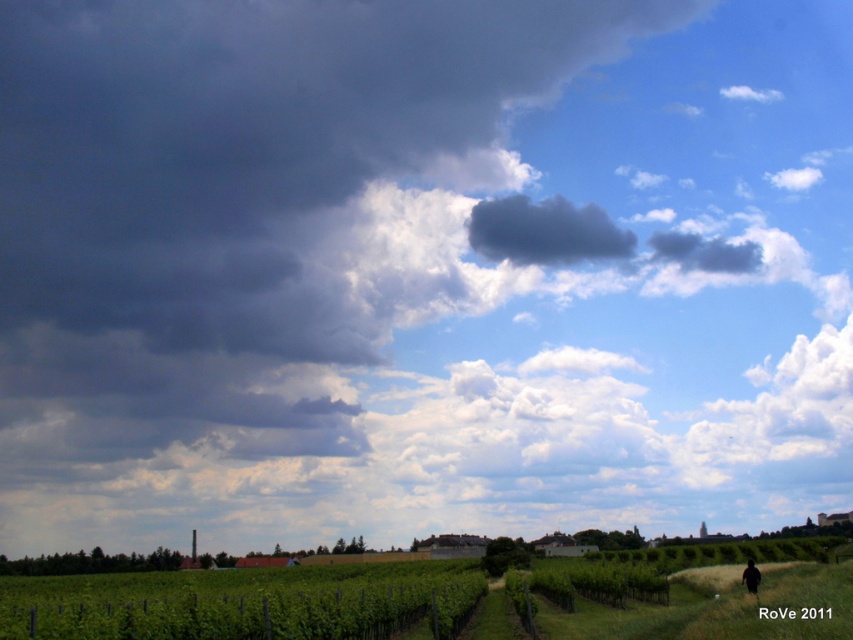
Question: Is dark gray cloud at upper center thinner than dark brown hair at lower right?

Choices:
 (A) no
 (B) yes

Answer: (A)

Question: Which object is closer to the camera taking this photo?

Choices:
 (A) dark gray cloud at upper center
 (B) dark brown hair at lower right

Answer: (B)

Question: Can you confirm if dark gray cloud at upper center is thinner than dark brown hair at lower right?

Choices:
 (A) no
 (B) yes

Answer: (A)

Question: Does dark gray cloud at upper center appear over dark brown hair at lower right?

Choices:
 (A) no
 (B) yes

Answer: (B)